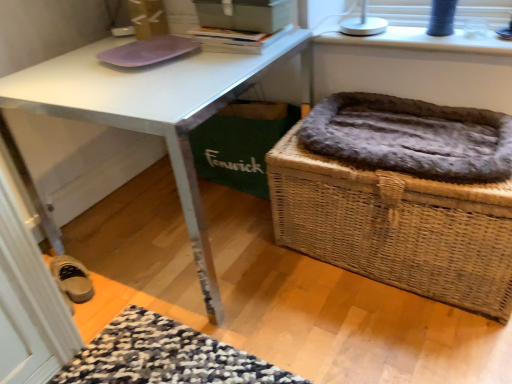
The width and height of the screenshot is (512, 384). What do you see at coordinates (245, 15) in the screenshot? I see `matte gray box at upper center` at bounding box center [245, 15].

Image resolution: width=512 pixels, height=384 pixels. In order to click on matte gray box at upper center in this screenshot , I will do [245, 15].

This screenshot has width=512, height=384. I want to click on white glossy desk at center, so click(x=157, y=110).

Where is `matte gray box at upper center`? This screenshot has width=512, height=384. matte gray box at upper center is located at coordinates (245, 15).

Is the surface of purple matte mousepad at upper left in direct contact with white glossy desk at center?

No.

From the image's perspective, is purple matte mousepad at upper left below white glossy desk at center?

No.

In the scene shown: Does fuzzy brown cat bed at lower right have a lesser height compared to hardcover book at upper center?

No.

Would you say fuzzy brown cat bed at lower right contains hardcover book at upper center?

No.

Is fuzzy brown cat bed at lower right turned away from hardcover book at upper center?

No, fuzzy brown cat bed at lower right's orientation is not away from hardcover book at upper center.

From the image's perspective, which one is positioned lower, matte gray box at upper center or purple matte mousepad at upper left?

purple matte mousepad at upper left appears lower in the image.

Which is in front, matte gray box at upper center or purple matte mousepad at upper left?

matte gray box at upper center is in front.

From a real-world perspective, between matte gray box at upper center and purple matte mousepad at upper left, who is vertically higher?

matte gray box at upper center.

In terms of size, does matte gray box at upper center appear bigger or smaller than purple matte mousepad at upper left?

Clearly, matte gray box at upper center is larger in size than purple matte mousepad at upper left.

Does point (481, 173) appear closer or farther from the camera than point (223, 28)?

Point (481, 173) appears to be closer to the viewer than point (223, 28).

From a real-world perspective, which object stands above the other?

From a 3D spatial view, matte gray box at upper center is above.

Is fuzzy brown cat bed at lower right not close to matte gray box at upper center?

fuzzy brown cat bed at lower right is near matte gray box at upper center, not far away.

Based on the photo, could you tell me if white glossy desk at center is turned towards fuzzy brown cat bed at lower right?

No, white glossy desk at center is not aimed at fuzzy brown cat bed at lower right.

From a real-world perspective, between white glossy desk at center and fuzzy brown cat bed at lower right, who is vertically lower?

white glossy desk at center is physically lower.

This screenshot has height=384, width=512. Find the location of `desk below the fuzzy brown cat bed at lower right (from a real-world perspective)`. desk below the fuzzy brown cat bed at lower right (from a real-world perspective) is located at coordinates pos(157,110).

Considering their positions, is white glossy desk at center located in front of or behind fuzzy brown cat bed at lower right?

Visually, white glossy desk at center is located in front of fuzzy brown cat bed at lower right.

From the image's perspective, relative to white glossy desk at center, is fur-lined wicker basket at right above or below?

Clearly, from the image's perspective, fur-lined wicker basket at right is below white glossy desk at center.

What's the angular difference between fur-lined wicker basket at right and white glossy desk at center's facing directions?

fur-lined wicker basket at right and white glossy desk at center are facing 0.342 degrees away from each other.

Which is more to the left, fur-lined wicker basket at right or white glossy desk at center?

Positioned to the left is white glossy desk at center.

From the image's perspective, which one is positioned higher, matte gray box at upper center or white plastic lamp at upper right?

matte gray box at upper center appears higher in the image.

Does point (267, 1) come farther from viewer compared to point (483, 38)?

No, it is not.

Considering the relative sizes of matte gray box at upper center and white plastic lamp at upper right in the image provided, is matte gray box at upper center smaller than white plastic lamp at upper right?

Correct, matte gray box at upper center occupies less space than white plastic lamp at upper right.

In the image, there is a purple matte mousepad at upper left. Where is `desk below it (from the image's perspective)`? This screenshot has height=384, width=512. desk below it (from the image's perspective) is located at coordinates (157, 110).

This screenshot has height=384, width=512. In the image, there is a hardcover book at upper center. Find the location of `cat bed below it (from a real-world perspective)`. cat bed below it (from a real-world perspective) is located at coordinates (411, 137).

Considering their positions, is white glossy desk at center positioned further to matte gray box at upper center than fuzzy brown cat bed at lower right?

fuzzy brown cat bed at lower right is positioned further to the anchor matte gray box at upper center.

When comparing their distances from white glossy desk at center, does fur-lined wicker basket at right or hardcover book at upper center seem further?

fur-lined wicker basket at right is positioned further to the anchor white glossy desk at center.

From the image, which object appears to be nearer to purple matte mousepad at upper left, fuzzy brown cat bed at lower right or white glossy desk at center?

white glossy desk at center.

Considering their positions, is white plastic lamp at upper right positioned closer to white glossy desk at center than fur-lined wicker basket at right?

Among the two, fur-lined wicker basket at right is located nearer to white glossy desk at center.

Which object lies nearer to the anchor point fur-lined wicker basket at right, white plastic lamp at upper right or purple matte mousepad at upper left?

white plastic lamp at upper right is positioned closer to the anchor fur-lined wicker basket at right.

Which object lies further to the anchor point white plastic lamp at upper right, hardcover book at upper center or fuzzy brown cat bed at lower right?

hardcover book at upper center.

When comparing their distances from fuzzy brown cat bed at lower right, does matte gray box at upper center or purple matte mousepad at upper left seem further?

purple matte mousepad at upper left is further to fuzzy brown cat bed at lower right.

Considering their positions, is fuzzy brown cat bed at lower right positioned further to matte gray box at upper center than white glossy desk at center?

fuzzy brown cat bed at lower right is positioned further to the anchor matte gray box at upper center.

Where is `cat bed between hardcover book at upper center and white plastic lamp at upper right`? cat bed between hardcover book at upper center and white plastic lamp at upper right is located at coordinates (411, 137).

You are a GUI agent. You are given a task and a screenshot of the screen. Output one action in this format:
    pyautogui.click(x=<x>, y=<y>)
    Task: Click on the book between purple matte mousepad at upper left and matte gray box at upper center in the horizontal direction
    
    Given the screenshot: What is the action you would take?
    pyautogui.click(x=236, y=40)

I want to click on box between purple matte mousepad at upper left and fur-lined wicker basket at right in the horizontal direction, so click(x=245, y=15).

You are a GUI agent. You are given a task and a screenshot of the screen. Output one action in this format:
    pyautogui.click(x=<x>, y=<y>)
    Task: Click on the book between white glossy desk at center and fur-lined wicker basket at right from left to right
    Image resolution: width=512 pixels, height=384 pixels.
    Given the screenshot: What is the action you would take?
    pyautogui.click(x=236, y=40)